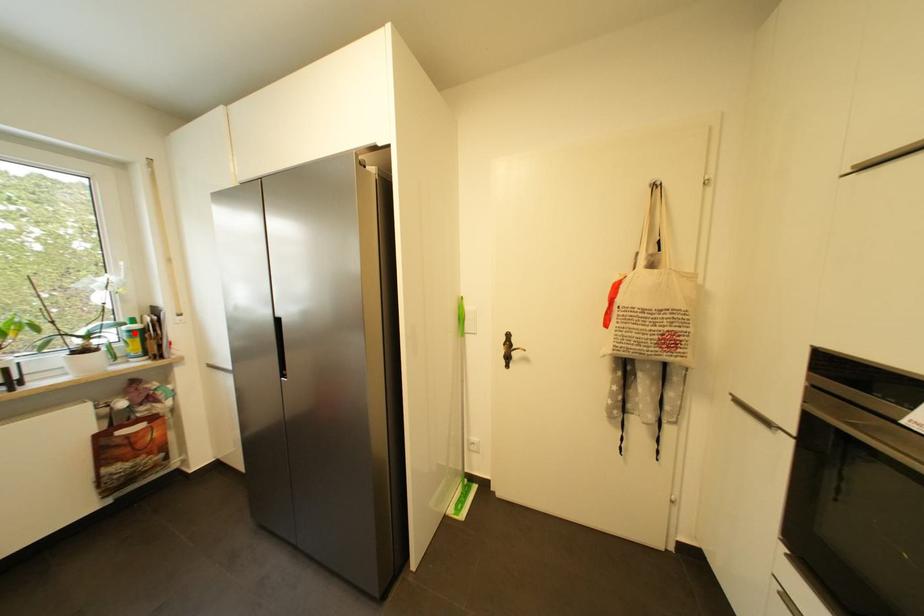
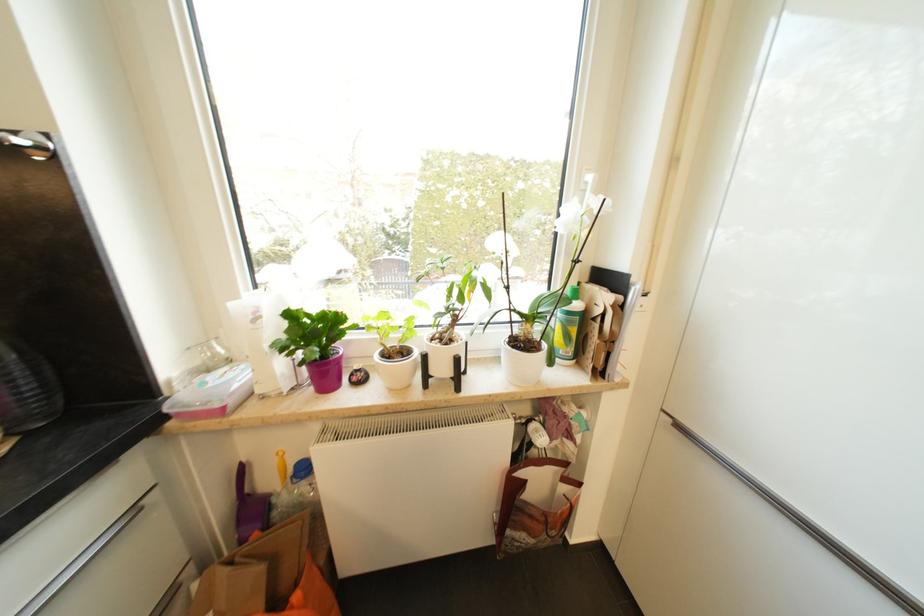
The point at the highlighted location is marked in the first image. Where is the corresponding point in the second image?

(574, 315)